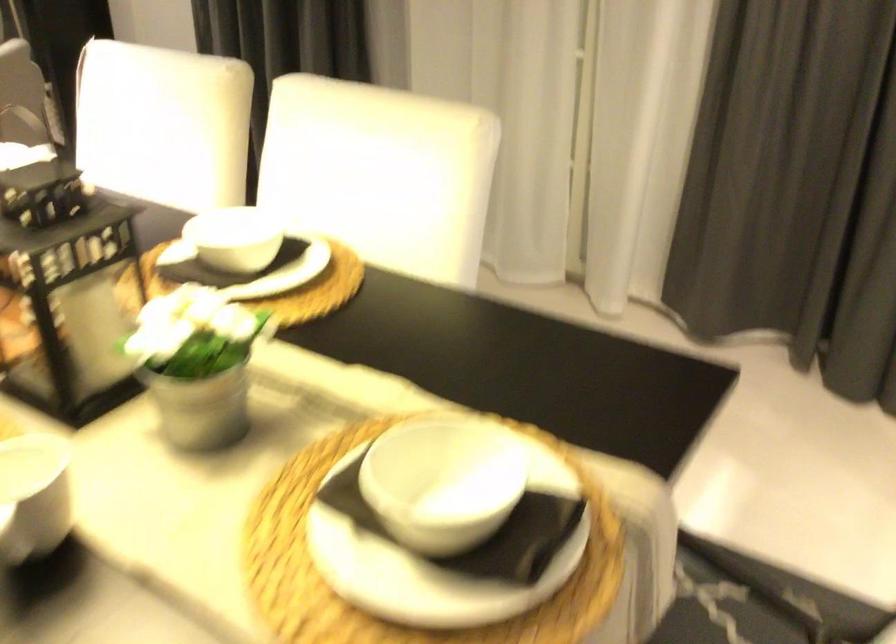
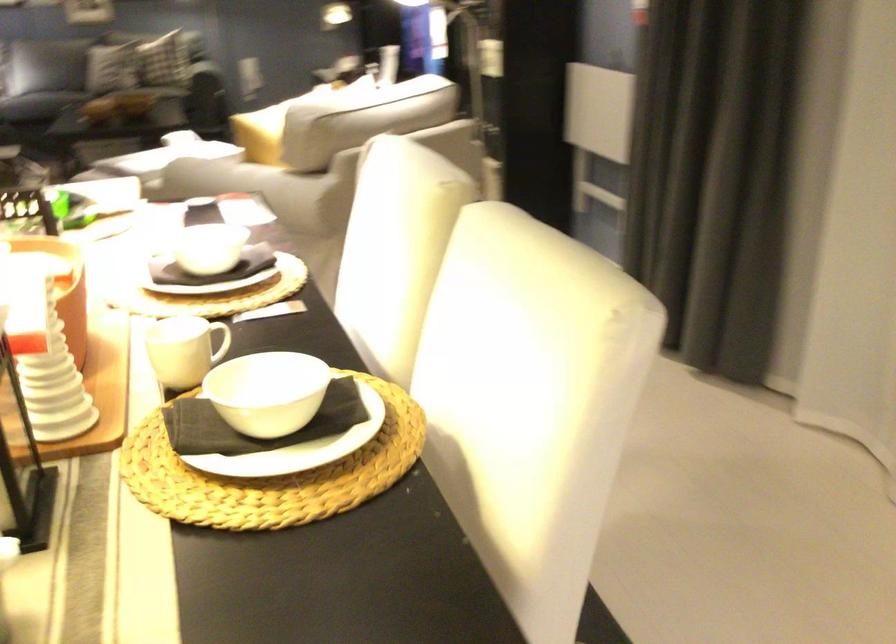
In the second image, find the point that corresponds to the point at 256,258 in the first image.

(259, 424)